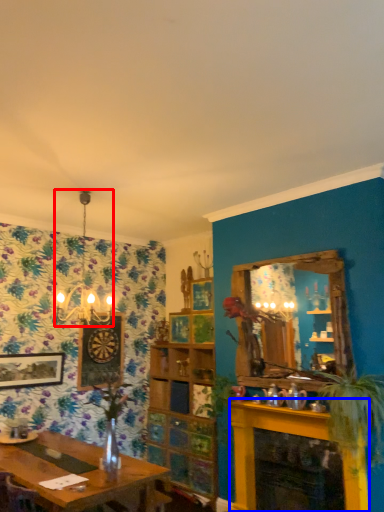
Question: Among these objects, which one is nearest to the camera, light fixture (highlighted by a red box) or fireplace (highlighted by a blue box)?

Choices:
 (A) light fixture
 (B) fireplace

Answer: (B)